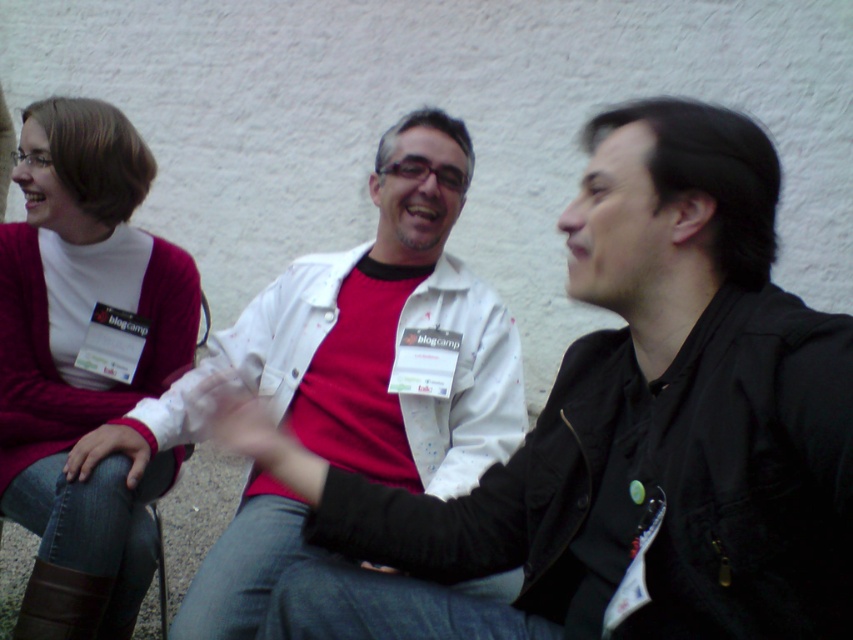
You are a photographer trying to capture a candid shot of the two people in the scene. The white matte jacket at center and the matte pink sweater at left are overlapping. Which one is covering the other?

Answer: The white matte jacket at center is positioned over the matte pink sweater at left, so it is covering the other.

You are standing in front of the three people in the image. Which of the two jackets, the matte white jacket at center or the white matte jacket at center, is positioned to the right?

The matte white jacket at center is to the right of the white matte jacket at center.

You are standing in front of the group and want to point out two specific points in the scene. The first point is at coordinates point (401, 241) and the second is at point (38, 413). Which point is closer to you?

Point (401, 241) is closer to the camera than point (38, 413).